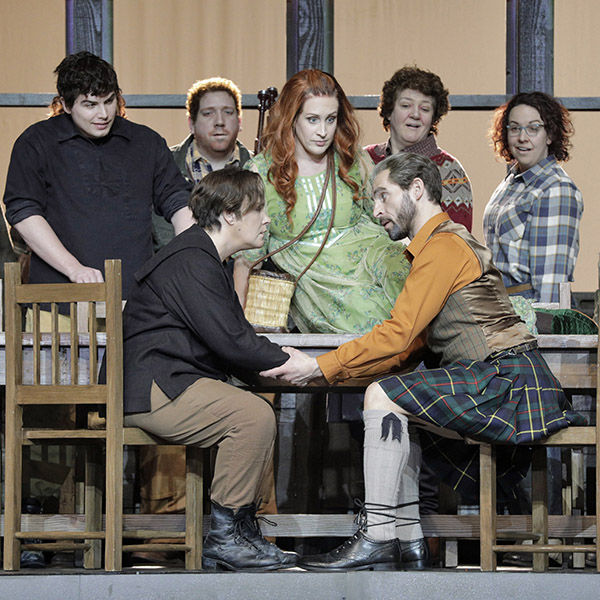
You are a GUI agent. You are given a task and a screenshot of the screen. Output one action in this format:
    pyautogui.click(x=<x>, y=<y>)
    Task: Click on the stage
    The width and height of the screenshot is (600, 600).
    Given the screenshot: What is the action you would take?
    pyautogui.click(x=342, y=571)